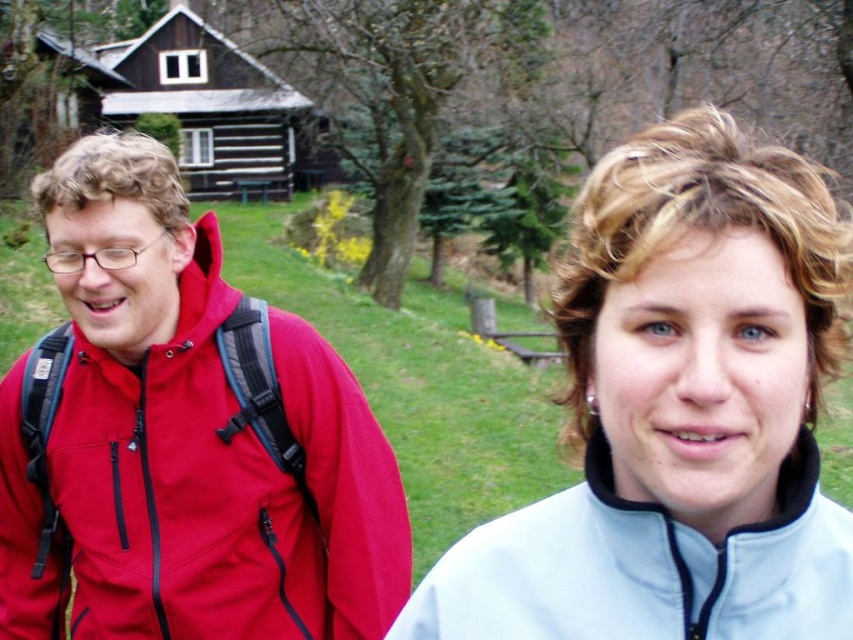
Between point (814, 381) and point (82, 413), which one is positioned behind?

The point (82, 413) is behind.

The image size is (853, 640). What do you see at coordinates (679, 412) in the screenshot? I see `light blue fleece jacket at center` at bounding box center [679, 412].

This screenshot has height=640, width=853. I want to click on light blue fleece jacket at center, so click(x=679, y=412).

Is light blue fleece jacket at center in front of white fleece sweatshirt at center?

That is True.

Describe the element at coordinates (679, 412) in the screenshot. I see `light blue fleece jacket at center` at that location.

Where is `light blue fleece jacket at center`? The image size is (853, 640). light blue fleece jacket at center is located at coordinates (679, 412).

Measure the distance between matte red jacket at left and white fleece sweatshirt at center.

matte red jacket at left and white fleece sweatshirt at center are 5.35 feet apart.

Who is more forward, (396, 532) or (822, 572)?

Point (822, 572)

Does point (103, 374) lie behind point (560, 500)?

Yes, it is behind point (560, 500).

This screenshot has width=853, height=640. What are the coordinates of `matte red jacket at left` in the screenshot? It's located at (183, 438).